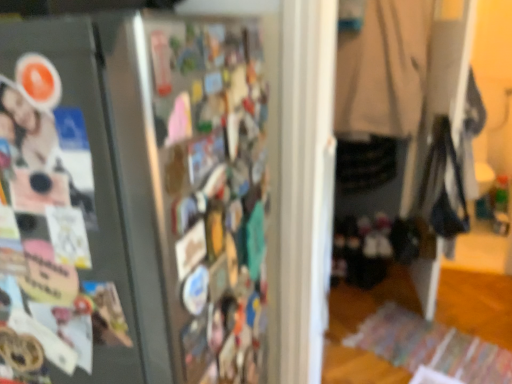
Question: Is matte photo at left beside satin black fridge at left?

Choices:
 (A) no
 (B) yes

Answer: (A)

Question: Is matte photo at left bigger than satin black fridge at left?

Choices:
 (A) yes
 (B) no

Answer: (B)

Question: From a real-world perspective, is matte photo at left positioned over satin black fridge at left based on gravity?

Choices:
 (A) yes
 (B) no

Answer: (A)

Question: From the image's perspective, is matte photo at left located above satin black fridge at left?

Choices:
 (A) no
 (B) yes

Answer: (B)

Question: Is the position of matte photo at left more distant than that of satin black fridge at left?

Choices:
 (A) yes
 (B) no

Answer: (A)

Question: Is matte photo at left shorter than satin black fridge at left?

Choices:
 (A) no
 (B) yes

Answer: (B)

Question: Is the surface of satin black fridge at left in direct contact with matte photo at left?

Choices:
 (A) no
 (B) yes

Answer: (A)

Question: Considering the relative positions of satin black fridge at left and matte photo at left in the image provided, is satin black fridge at left to the right of matte photo at left from the viewer's perspective?

Choices:
 (A) yes
 (B) no

Answer: (A)

Question: Can you confirm if satin black fridge at left is thinner than matte photo at left?

Choices:
 (A) no
 (B) yes

Answer: (A)

Question: Considering the relative positions of satin black fridge at left and matte photo at left in the image provided, is satin black fridge at left in front of matte photo at left?

Choices:
 (A) no
 (B) yes

Answer: (B)

Question: Is satin black fridge at left taller than matte photo at left?

Choices:
 (A) no
 (B) yes

Answer: (B)

Question: Could you tell me if satin black fridge at left is facing matte photo at left?

Choices:
 (A) no
 (B) yes

Answer: (A)

Question: Is matte photo at left facing towards beige fabric coat at center?

Choices:
 (A) yes
 (B) no

Answer: (B)